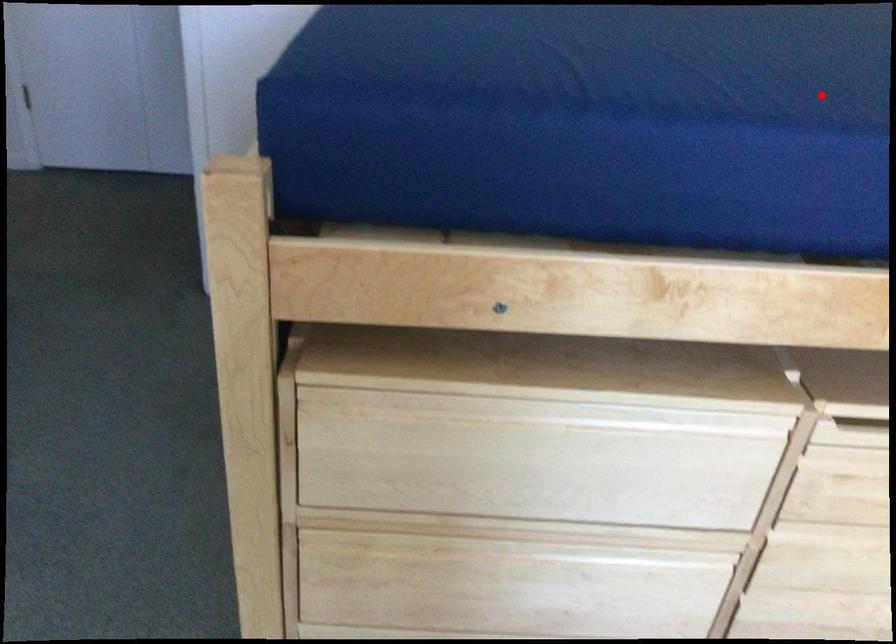
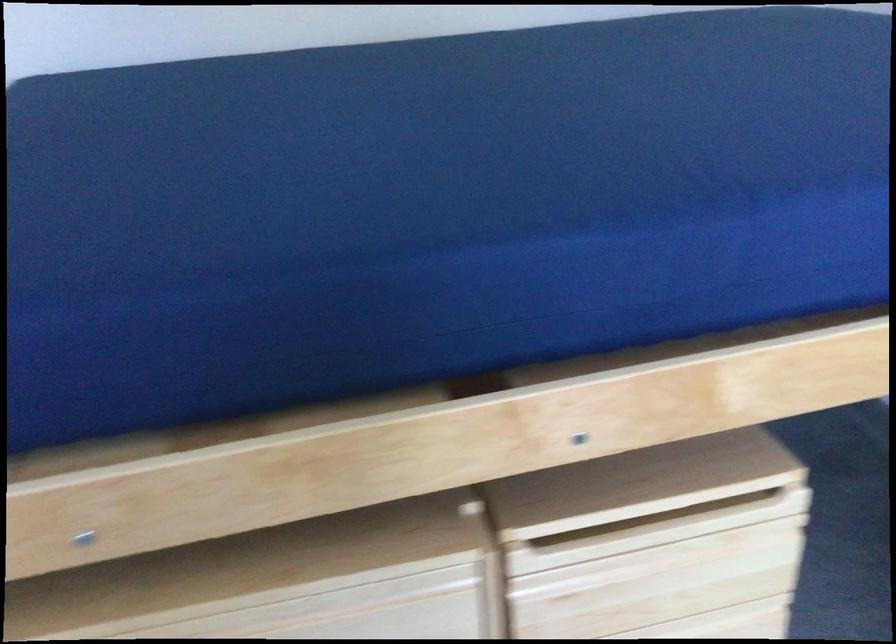
Question: I am providing you with two images of the same scene from different viewpoints. A red point is marked on the first image. Can you still see the location of the red point in image 2?

Choices:
 (A) Yes
 (B) No

Answer: (A)